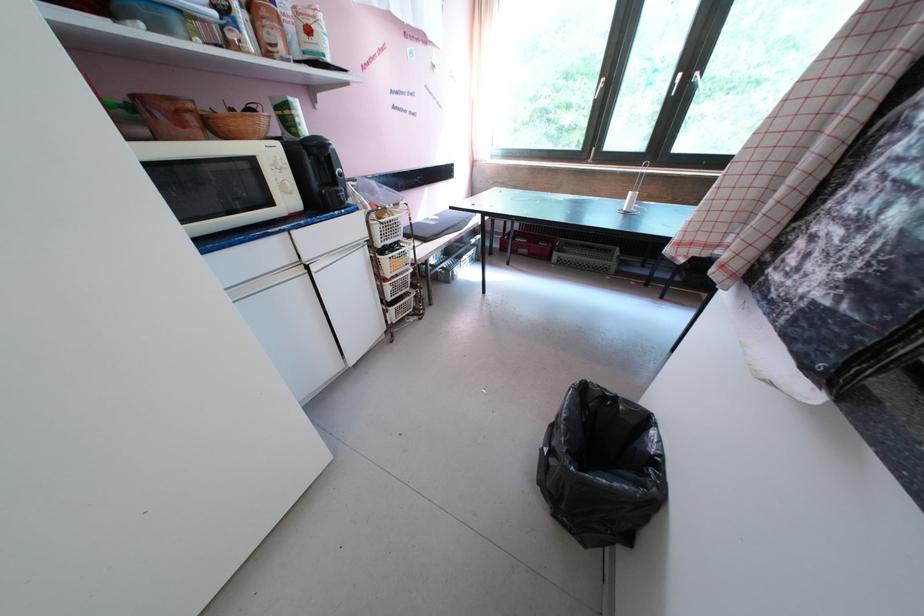
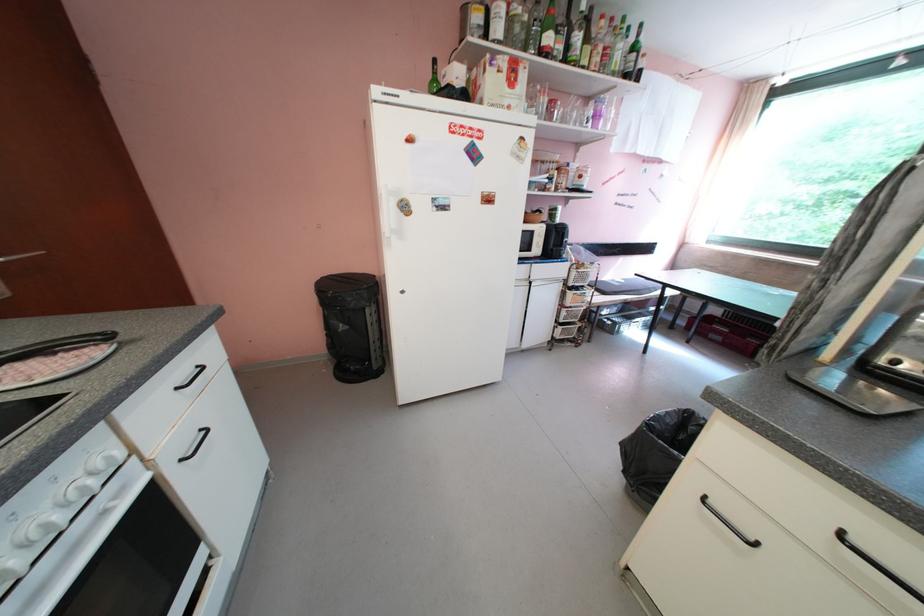
Where in the second image is the point corresponding to the point at 387,214 from the first image?

(588, 268)